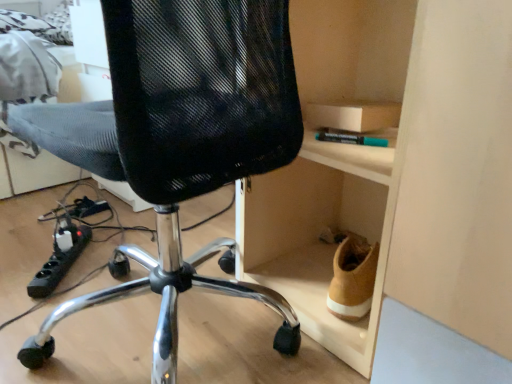
Question: Is black mesh chair at center further to camera compared to wooden cabinet at right?

Choices:
 (A) no
 (B) yes

Answer: (A)

Question: From the image's perspective, is black mesh chair at center on wooden cabinet at right?

Choices:
 (A) no
 (B) yes

Answer: (A)

Question: Could wooden cabinet at right be considered to be inside black mesh chair at center?

Choices:
 (A) yes
 (B) no

Answer: (B)

Question: Considering the relative positions of black mesh chair at center and wooden cabinet at right in the image provided, is black mesh chair at center to the left of wooden cabinet at right from the viewer's perspective?

Choices:
 (A) yes
 (B) no

Answer: (A)

Question: Are black mesh chair at center and wooden cabinet at right far apart?

Choices:
 (A) no
 (B) yes

Answer: (A)

Question: Is black plastic power strip at lower left spatially inside wooden cabinet at right, or outside of it?

Choices:
 (A) inside
 (B) outside

Answer: (B)

Question: Does point (54, 283) appear closer or farther from the camera than point (324, 46)?

Choices:
 (A) farther
 (B) closer

Answer: (A)

Question: Based on their sizes in the image, would you say black plastic power strip at lower left is bigger or smaller than wooden cabinet at right?

Choices:
 (A) big
 (B) small

Answer: (B)

Question: In terms of height, does black plastic power strip at lower left look taller or shorter compared to wooden cabinet at right?

Choices:
 (A) tall
 (B) short

Answer: (B)

Question: Looking at their shapes, would you say black plastic power strip at lower left is wider or thinner than black mesh chair at center?

Choices:
 (A) thin
 (B) wide

Answer: (A)

Question: Is black plastic power strip at lower left bigger or smaller than black mesh chair at center?

Choices:
 (A) big
 (B) small

Answer: (B)

Question: From a real-world perspective, is black plastic power strip at lower left positioned above or below black mesh chair at center?

Choices:
 (A) above
 (B) below

Answer: (B)

Question: Would you say black plastic power strip at lower left is to the left or to the right of black mesh chair at center in the picture?

Choices:
 (A) left
 (B) right

Answer: (A)

Question: Is point (157, 370) closer or farther from the camera than point (53, 274)?

Choices:
 (A) farther
 (B) closer

Answer: (B)

Question: From a real-world perspective, relative to black plastic power strip at lower left, is black mesh chair at center vertically above or below?

Choices:
 (A) above
 (B) below

Answer: (A)